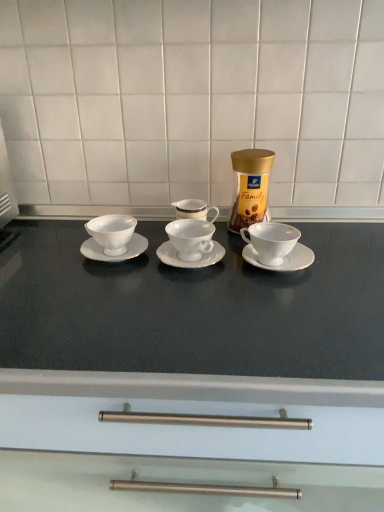
Question: From the image's perspective, relative to white porcelain cup at left, the first coffee cup from the left, is white ceramic saucer at right, positioned as the first saucer in right-to-left order, above or below?

Choices:
 (A) below
 (B) above

Answer: (A)

Question: Looking at their shapes, would you say white ceramic saucer at right, marked as the 3th saucer in a left-to-right arrangement, is wider or thinner than white porcelain cup at left, the first coffee cup from the left?

Choices:
 (A) wide
 (B) thin

Answer: (A)

Question: Which of these objects is positioned farthest from the white porcelain saucer at center, marked as the 2th saucer in a right-to-left arrangement?

Choices:
 (A) white porcelain cup at right, acting as the 1th coffee cup starting from the right
 (B) white ceramic saucer at right, positioned as the first saucer in right-to-left order
 (C) gold metallic jar at center
 (D) matte white countertop at center
 (E) white porcelain cup at left, the first coffee cup from the left

Answer: (D)

Question: Considering the real-world distances, which object is farthest from the white porcelain cup at left, the first coffee cup from the left?

Choices:
 (A) matte white countertop at center
 (B) white porcelain cup at center, the second coffee cup when ordered from right to left
 (C) white porcelain saucer at left, the 1th saucer in the left-to-right sequence
 (D) white porcelain cup at right, acting as the 1th coffee cup starting from the right
 (E) gold metallic jar at center

Answer: (A)